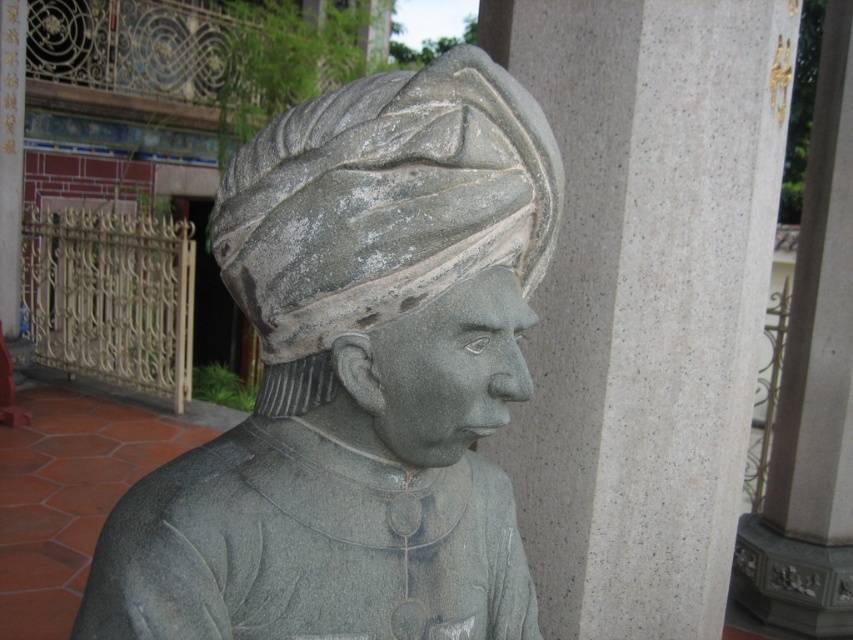
In the scene shown: You are an art conservator examining the image of a stone sculpture. You need to determine the spatial relationship between the gray stone statue at center and the gray stone headscarf at center. Which object is positioned to the right of the other?

The gray stone statue at center is to the right of the gray stone headscarf at center.

You are standing in front of the stone bust sculpture. There is a point at coordinates point (689,140). Can you reach that point with your hand if you extend it fully?

The point (689,140) is 7.19 feet away from you, which is too far to reach with an outstretched hand. You would need to move closer or use a tool to reach it.